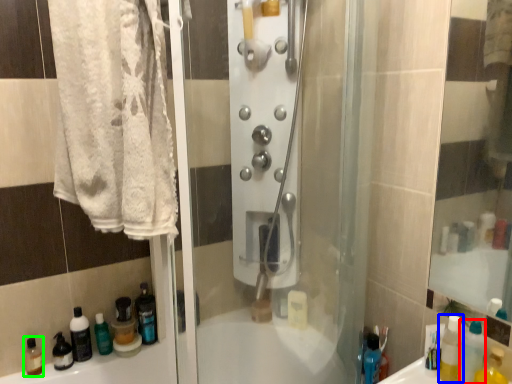
Question: Based on their relative distances, which object is nearer to bottle (highlighted by a red box)? Choose from mouthwash (highlighted by a blue box) and mouthwash (highlighted by a green box).

Choices:
 (A) mouthwash
 (B) mouthwash

Answer: (A)